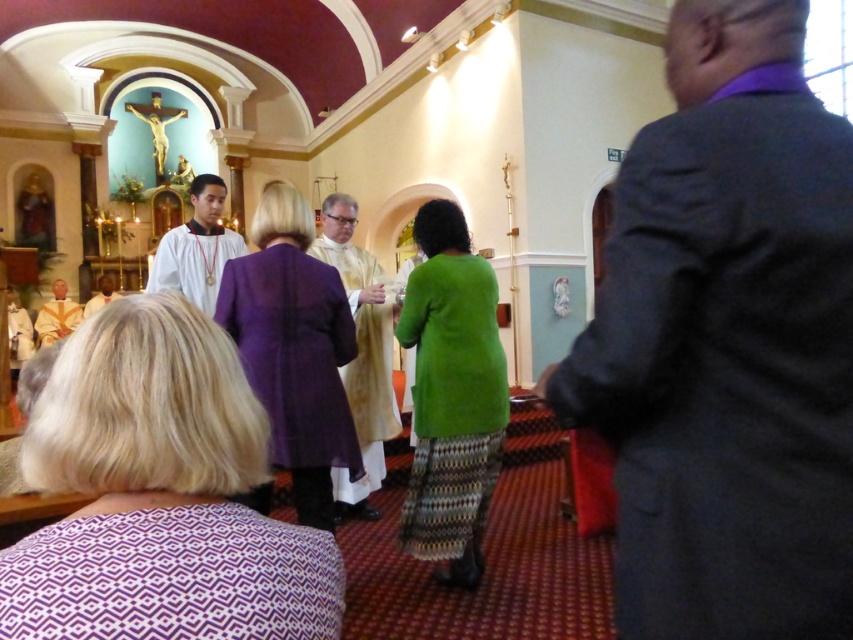
Question: Among these objects, which one is farthest from the camera?

Choices:
 (A) dark gray suit at right
 (B) gold textured robe at center
 (C) purple woven cloth at lower left

Answer: (B)

Question: Can you confirm if dark gray suit at right is positioned below white satin robe at center?

Choices:
 (A) yes
 (B) no

Answer: (A)

Question: From the image, what is the correct spatial relationship of gold textured robe at center in relation to matte white robe at center?

Choices:
 (A) right
 (B) left

Answer: (A)

Question: Among these points, which one is farthest from the camera?

Choices:
 (A) (91, 310)
 (B) (331, 449)
 (C) (426, 211)

Answer: (A)

Question: Does purple fabric at lower center lie in front of purple sheer dress at center?

Choices:
 (A) yes
 (B) no

Answer: (A)

Question: Which point is farther to the camera?

Choices:
 (A) (189, 285)
 (B) (267, 634)
 (C) (811, 154)
 (D) (173, 621)

Answer: (A)